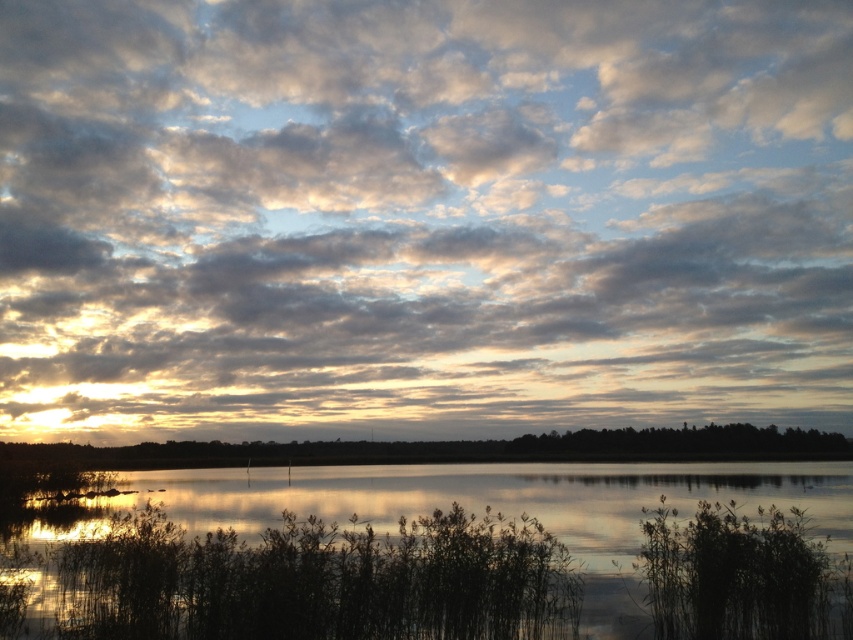
Can you confirm if cloudy sky at upper center is positioned to the left of transparent water at center?

Correct, you'll find cloudy sky at upper center to the left of transparent water at center.

Is point (376, 323) closer to camera compared to point (589, 524)?

No, it is not.

The width and height of the screenshot is (853, 640). Identify the location of cloudy sky at upper center. click(x=422, y=216).

Is point (511, 170) less distant than point (706, 426)?

Yes, it is.

Who is taller, cloudy sky at upper center or silvery reflective water at center?

cloudy sky at upper center

This screenshot has height=640, width=853. I want to click on cloudy sky at upper center, so click(422, 216).

In order to click on cloudy sky at upper center in this screenshot , I will do `click(422, 216)`.

Which is in front, point (305, 481) or point (186, 454)?

Point (305, 481) is more forward.

You are a GUI agent. You are given a task and a screenshot of the screen. Output one action in this format:
    pyautogui.click(x=<x>, y=<y>)
    Task: Click on the transparent water at center
    Image resolution: width=853 pixels, height=640 pixels.
    Given the screenshot: What is the action you would take?
    pyautogui.click(x=503, y=502)